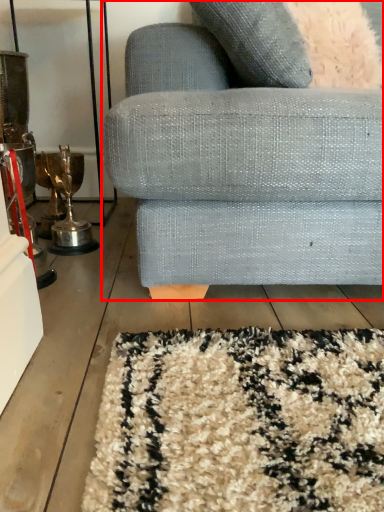
Question: From the image's perspective, where is studio couch (annotated by the red box) located in relation to throw pillow in the image?

Choices:
 (A) above
 (B) below

Answer: (B)